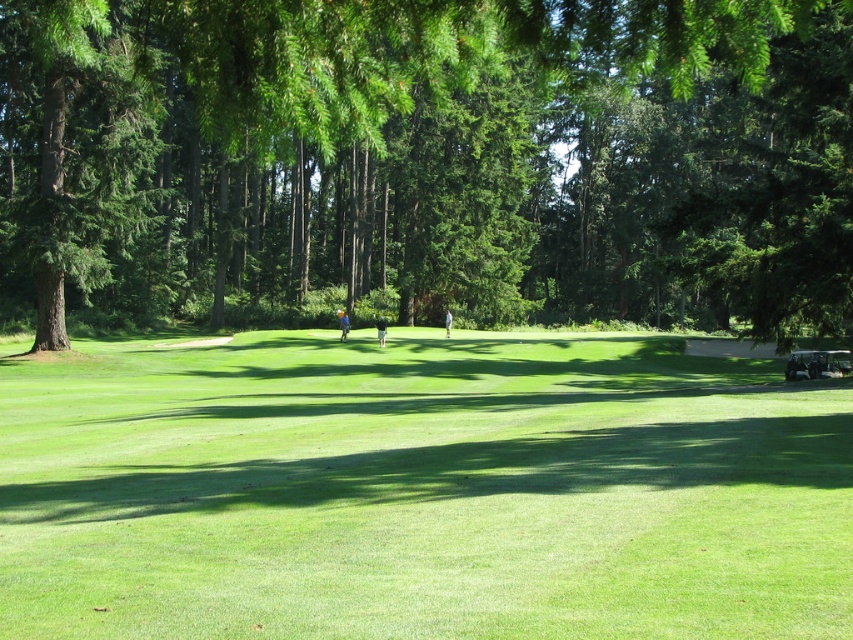
Question: Does green leafy tree at center have a smaller size compared to green grassy field at center?

Choices:
 (A) no
 (B) yes

Answer: (A)

Question: Can you confirm if green leafy tree at center is positioned below green grassy field at center?

Choices:
 (A) no
 (B) yes

Answer: (A)

Question: Does green leafy tree at center have a lesser width compared to green grassy field at center?

Choices:
 (A) no
 (B) yes

Answer: (A)

Question: Which object appears farthest from the camera in this image?

Choices:
 (A) green leafy tree at center
 (B) green grassy field at center

Answer: (A)